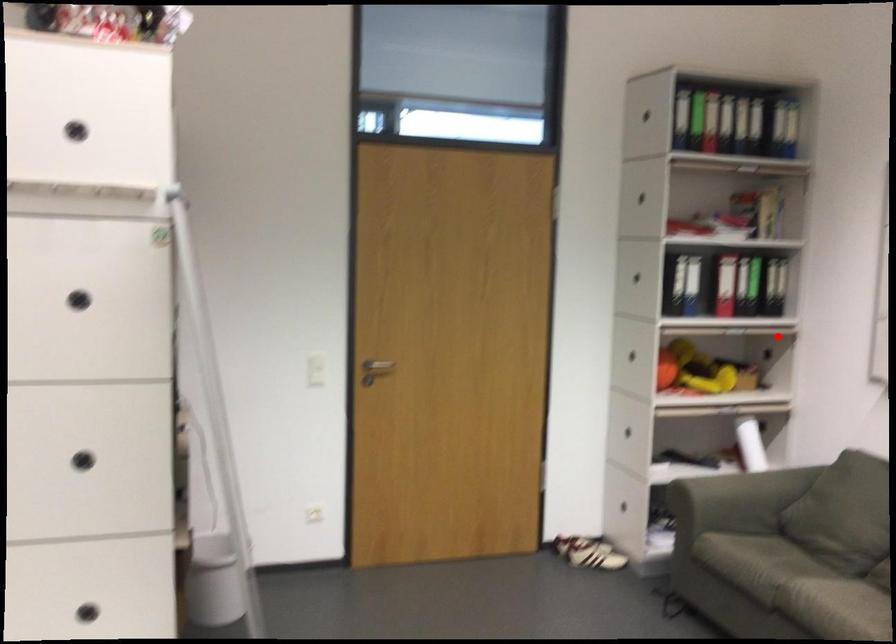
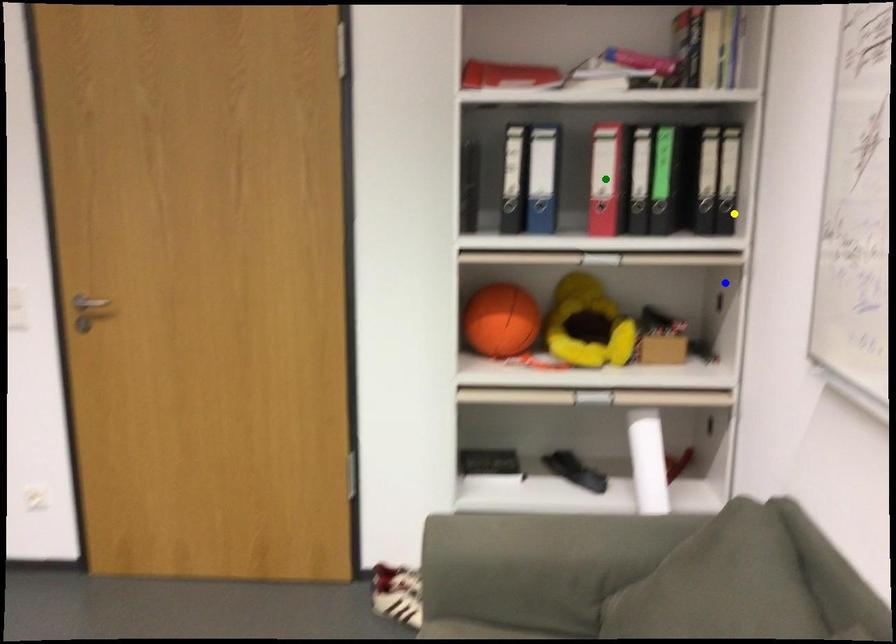
Question: I am providing you with two images of the same scene from different viewpoints. A red point is marked on the first image. You are given multiple points on the second image. Which spot in image 2 lines up with the point in image 1?

Choices:
 (A) yellow point
 (B) blue point
 (C) green point

Answer: (B)